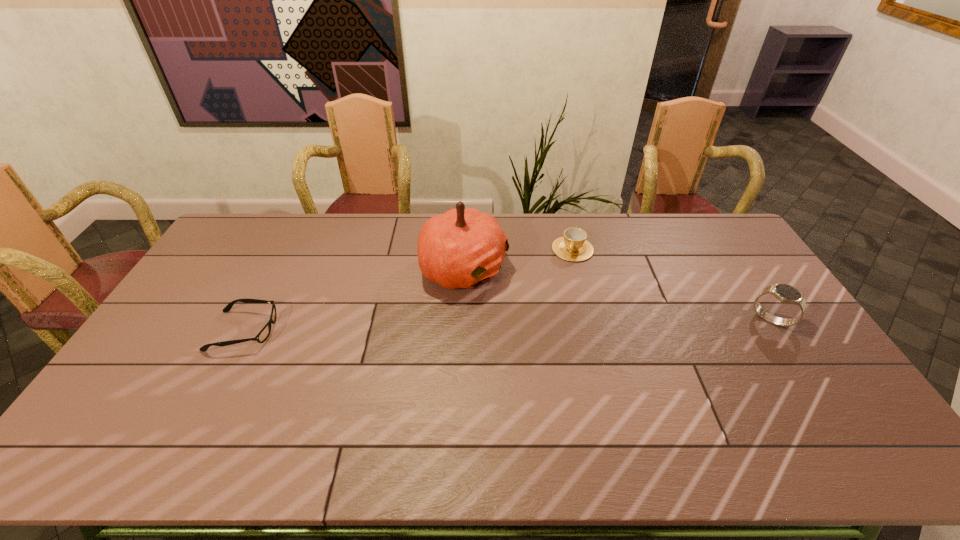
Where is `free space at the far edge of the desktop`? free space at the far edge of the desktop is located at coordinates [x=556, y=233].

The height and width of the screenshot is (540, 960). Identify the location of free spot at the near edge of the desktop. (730, 393).

Where is `free space at the left edge of the desktop`? This screenshot has height=540, width=960. free space at the left edge of the desktop is located at coordinates (147, 345).

This screenshot has width=960, height=540. In order to click on free spot at the right edge of the desktop in this screenshot , I will do `click(798, 379)`.

Identify the location of free space that is in between the cup and the shortest object. (408, 290).

Where is `vacant space that's between the leftmost object and the third object from right to left`? The image size is (960, 540). vacant space that's between the leftmost object and the third object from right to left is located at coordinates (354, 300).

What are the coordinates of `empty location between the third tallest object and the third object from right to left` in the screenshot? It's located at (518, 259).

At what (x,y) coordinates should I click in order to perform the action: click on vacant point located between the watch and the third tallest object. Please return your answer as a coordinate pair (x, y). The height and width of the screenshot is (540, 960). Looking at the image, I should click on (672, 285).

I want to click on unoccupied position between the rightmost object and the spectacles, so click(x=508, y=325).

Where is `vacant space that is in between the second shortest object and the tallest object`? This screenshot has height=540, width=960. vacant space that is in between the second shortest object and the tallest object is located at coordinates pos(518,259).